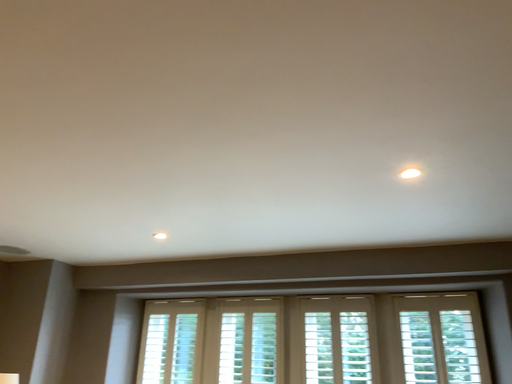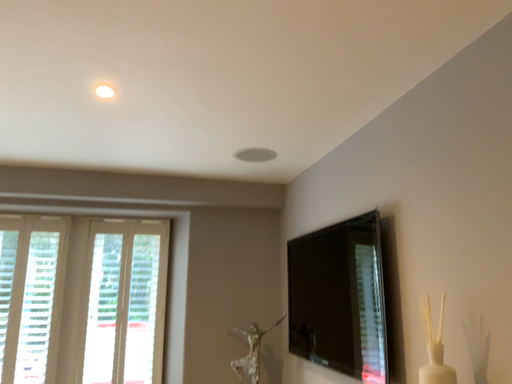
Question: Which way did the camera rotate in the video?

Choices:
 (A) rotated right
 (B) rotated left

Answer: (A)